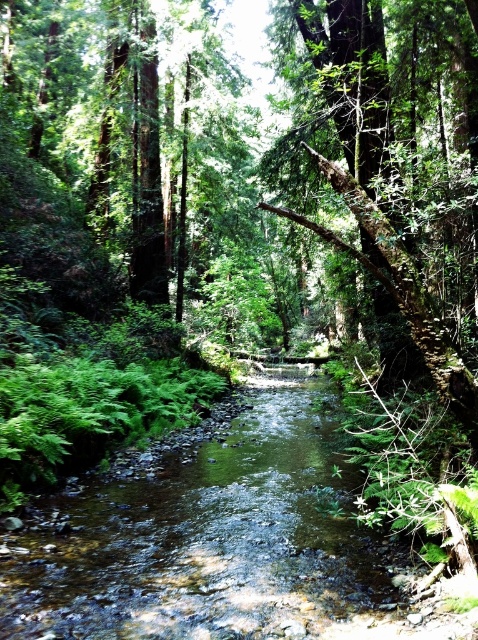
You are a hiker trying to cross the stream. You see the clear water stream at center and the mossy bark tree at center. Which object is closer to you as you stand on the bank?

The clear water stream at center is closer to you because it is in front of the mossy bark tree at center.

You are standing at the point marked by the coordinates point (208, 541) in the forest scene. Based on the image, what type of terrain are you most likely standing on?

The clear water stream at center is represented by point (208, 541), so you are most likely standing in the clear water stream at center.